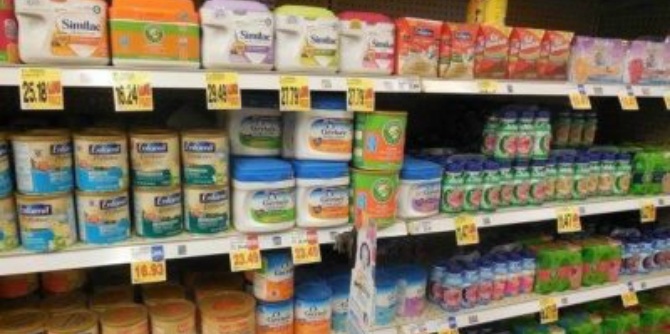
This screenshot has height=334, width=670. Find the location of `blue food container`. blue food container is located at coordinates (628, 248).